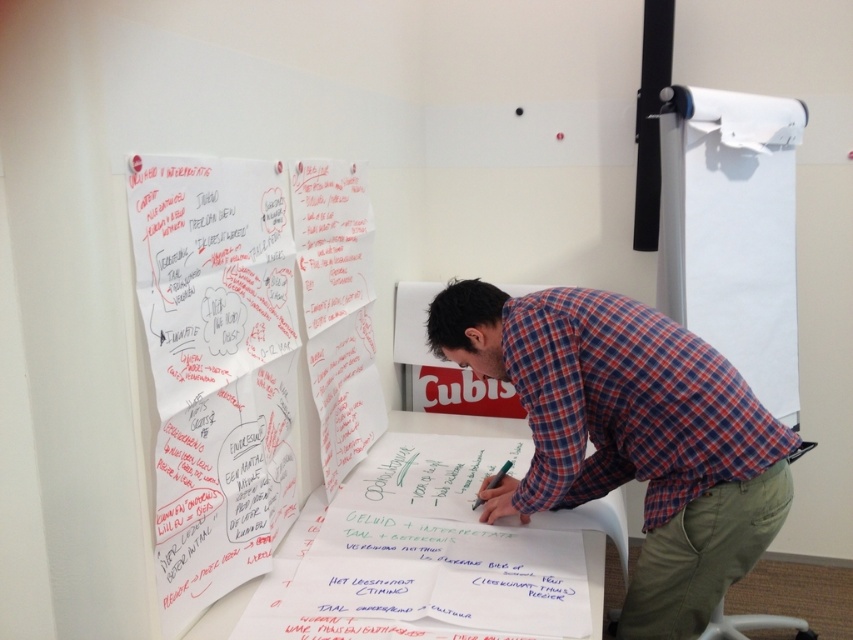
You are a photographer positioned behind the person writing. You want to take a clear photo of the green matte pen at center without the plaid shirt at center blocking it. Is this possible?

The plaid shirt at center is closer to the viewer than the green matte pen at center, so the plaid shirt would block the view of the green matte pen at center. Therefore, it is not possible to take a clear photo of the green matte pen at center without the plaid shirt at center blocking it.

You are a photographer positioned behind the person. You want to take a photo of the white paper at center without the plaid shirt at center blocking the view. Is this possible?

The plaid shirt at center is closer to the viewer than the white paper at center, so taking a photo from behind the person would still have the plaid shirt at center blocking the view of the white paper at center.

You are standing at the origin point in the image. Which of the two points, point (604,490) or point (589,547), is closer to you?

Point (589,547) is closer to you because it is in front of point (604,490).